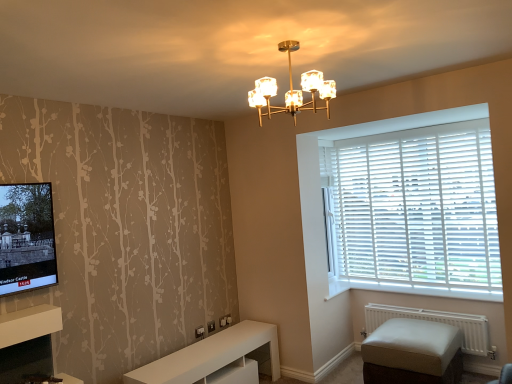
What is the approximate height of white wood at lower right?

4.34 centimeters.

This screenshot has width=512, height=384. Describe the element at coordinates (439, 322) in the screenshot. I see `white matte radiator at lower right` at that location.

What are the coordinates of `white matte radiator at lower right` in the screenshot? It's located at [439, 322].

Describe the element at coordinates (216, 358) in the screenshot. The width and height of the screenshot is (512, 384). I see `white glossy cabinet at lower center` at that location.

Where is `gold metallic chandelier at upper center`? Image resolution: width=512 pixels, height=384 pixels. gold metallic chandelier at upper center is located at coordinates pos(292,89).

Is beige fabric ottoman at lower right oriented towards white matte radiator at lower right?

No, beige fabric ottoman at lower right does not turn towards white matte radiator at lower right.

Is beige fabric ottoman at lower right to the right of white matte radiator at lower right from the viewer's perspective?

Incorrect, beige fabric ottoman at lower right is not on the right side of white matte radiator at lower right.

Considering the sizes of objects beige fabric ottoman at lower right and white matte radiator at lower right in the image provided, who is taller, beige fabric ottoman at lower right or white matte radiator at lower right?

Standing taller between the two is beige fabric ottoman at lower right.

In the scene shown: Is white matte radiator at lower right not within beige fabric ottoman at lower right?

Yes, white matte radiator at lower right is not within beige fabric ottoman at lower right.

Is the depth of white matte radiator at lower right greater than that of beige fabric ottoman at lower right?

Yes, white matte radiator at lower right is further from the viewer.

From the image's perspective, is white matte radiator at lower right over beige fabric ottoman at lower right?

Yes, from the image's perspective, white matte radiator at lower right is on top of beige fabric ottoman at lower right.

Considering the sizes of objects white matte radiator at lower right and beige fabric ottoman at lower right in the image provided, who is smaller, white matte radiator at lower right or beige fabric ottoman at lower right?

white matte radiator at lower right.

From the image's perspective, is beige fabric ottoman at lower right located above white wood at lower right?

No.

Is beige fabric ottoman at lower right behind white wood at lower right?

No, it is not.

Measure the distance from beige fabric ottoman at lower right to white wood at lower right.

A distance of 26.48 inches exists between beige fabric ottoman at lower right and white wood at lower right.

From a real-world perspective, relative to white wood at lower right, is beige fabric ottoman at lower right vertically above or below?

beige fabric ottoman at lower right is below white wood at lower right.

From the image's perspective, is white glossy cabinet at lower center above white matte shelf at lower left?

No, from the image's perspective, white glossy cabinet at lower center is not above white matte shelf at lower left.

Does white glossy cabinet at lower center touch white matte shelf at lower left?

No, white glossy cabinet at lower center is not with white matte shelf at lower left.

Considering the positions of objects white glossy cabinet at lower center and white matte shelf at lower left in the image provided, who is more to the left, white glossy cabinet at lower center or white matte shelf at lower left?

From the viewer's perspective, white matte shelf at lower left appears more on the left side.

This screenshot has height=384, width=512. What are the coordinates of `shelf that is above the white glossy cabinet at lower center (from the image's perspective)` in the screenshot? It's located at (29, 324).

Do you think white matte radiator at lower right is within white wood blinds at right, or outside of it?

white matte radiator at lower right exists outside the volume of white wood blinds at right.

Is point (477, 330) positioned behind point (341, 171)?

No, it is in front of (341, 171).

Is white matte radiator at lower right positioned with its back to white wood blinds at right?

white matte radiator at lower right is not turned away from white wood blinds at right.

Relative to white wood at lower right, is white wood blinds at right in front or behind?

white wood blinds at right is positioned farther from the viewer than white wood at lower right.

Is white wood blinds at right situated inside white wood at lower right or outside?

white wood blinds at right is not inside white wood at lower right, it's outside.

From a real-world perspective, is white wood blinds at right above or below white wood at lower right?

From a real-world perspective, white wood blinds at right is physically above white wood at lower right.

Is beige fabric ottoman at lower right not close to white glossy cabinet at lower center?

Yes, beige fabric ottoman at lower right is far from white glossy cabinet at lower center.

Which of these two, beige fabric ottoman at lower right or white glossy cabinet at lower center, is bigger?

With larger size is white glossy cabinet at lower center.

From the picture: From the image's perspective, is beige fabric ottoman at lower right under white glossy cabinet at lower center?

Actually, beige fabric ottoman at lower right appears above white glossy cabinet at lower center in the image.

From a real-world perspective, is beige fabric ottoman at lower right over white glossy cabinet at lower center?

Correct, in the physical world, beige fabric ottoman at lower right is higher than white glossy cabinet at lower center.

At what (x,y) coordinates should I click in order to perform the action: click on studio couch that appears below the white matte radiator at lower right (from a real-world perspective). Please return your answer as a coordinate pair (x, y). The height and width of the screenshot is (384, 512). Looking at the image, I should click on (413, 353).

Where is `studio couch on the left of white matte radiator at lower right`? This screenshot has width=512, height=384. studio couch on the left of white matte radiator at lower right is located at coordinates (413, 353).

Consider the image. Which object lies further to the anchor point white matte radiator at lower right, white matte shelf at lower left or gold metallic chandelier at upper center?

The object further to white matte radiator at lower right is white matte shelf at lower left.

Estimate the real-world distances between objects in this image. Which object is further from gold metallic chandelier at upper center, white matte radiator at lower right or white glossy cabinet at lower center?

white matte radiator at lower right is positioned further to the anchor gold metallic chandelier at upper center.

From the image, which object appears to be nearer to white matte radiator at lower right, white wood blinds at right or beige fabric ottoman at lower right?

Among the two, beige fabric ottoman at lower right is located nearer to white matte radiator at lower right.

Based on their spatial positions, is gold metallic chandelier at upper center or beige fabric ottoman at lower right closer to white wood blinds at right?

beige fabric ottoman at lower right is closer to white wood blinds at right.

Estimate the real-world distances between objects in this image. Which object is further from white glossy cabinet at lower center, beige fabric ottoman at lower right or white matte radiator at lower right?

Based on the image, white matte radiator at lower right appears to be further to white glossy cabinet at lower center.

Considering their positions, is white matte shelf at lower left positioned further to beige fabric ottoman at lower right than white matte radiator at lower right?

white matte shelf at lower left lies further to beige fabric ottoman at lower right than the other object.

When comparing their distances from white glossy cabinet at lower center, does white wood at lower right or gold metallic chandelier at upper center seem closer?

white wood at lower right is positioned closer to the anchor white glossy cabinet at lower center.

When comparing their distances from white wood blinds at right, does white wood at lower right or white matte shelf at lower left seem further?

white matte shelf at lower left.

Identify the location of window sill that lies between white wood blinds at right and beige fabric ottoman at lower right from top to bottom. Image resolution: width=512 pixels, height=384 pixels. (413, 289).

Where is `radiator between gold metallic chandelier at upper center and white wood at lower right along the z-axis`? radiator between gold metallic chandelier at upper center and white wood at lower right along the z-axis is located at coordinates (439, 322).

This screenshot has width=512, height=384. What are the coordinates of `studio couch between gold metallic chandelier at upper center and white glossy cabinet at lower center vertically` in the screenshot? It's located at (413, 353).

The height and width of the screenshot is (384, 512). I want to click on studio couch situated between white matte shelf at lower left and white matte radiator at lower right from left to right, so click(413, 353).